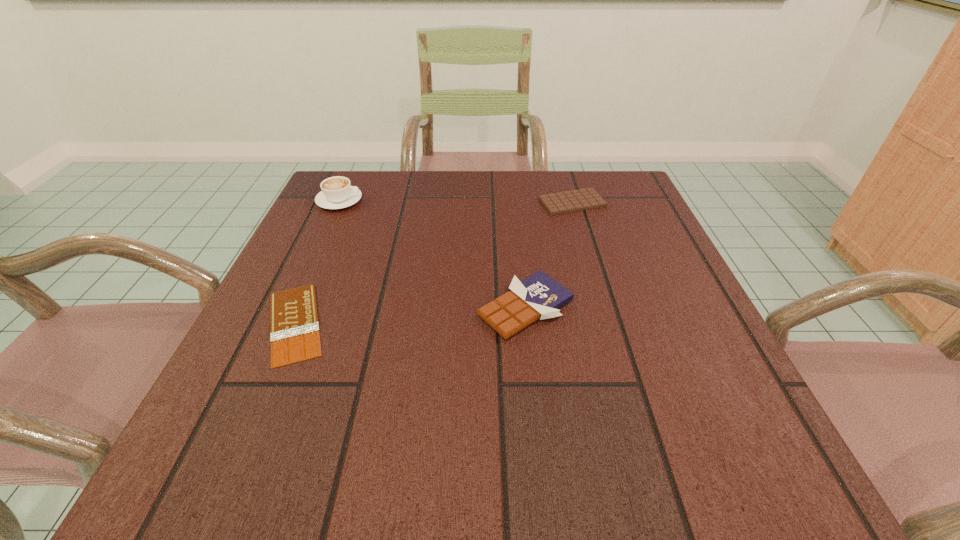
In the image, there is a desktop. Where is `free region at the right edge`? This screenshot has height=540, width=960. free region at the right edge is located at coordinates (717, 361).

Find the location of a particular element. The height and width of the screenshot is (540, 960). vacant space at the far left corner is located at coordinates click(x=341, y=176).

In order to click on vacant space at the near left corner in this screenshot , I will do `click(197, 472)`.

Locate an element on the screen. free space at the far right corner of the desktop is located at coordinates (594, 174).

Where is `free space at the near right corner of the desktop`? The height and width of the screenshot is (540, 960). free space at the near right corner of the desktop is located at coordinates [x=709, y=439].

Where is `free spot between the farthest chocolate bar and the leftmost chocolate bar`? The image size is (960, 540). free spot between the farthest chocolate bar and the leftmost chocolate bar is located at coordinates (434, 263).

The height and width of the screenshot is (540, 960). Find the location of `free space that is in between the farthest chocolate bar and the shortest chocolate bar`. free space that is in between the farthest chocolate bar and the shortest chocolate bar is located at coordinates (434, 263).

Locate an element on the screen. Image resolution: width=960 pixels, height=540 pixels. vacant space that's between the tallest object and the leftmost chocolate bar is located at coordinates (317, 262).

Locate an element on the screen. free space between the tallest object and the farthest chocolate bar is located at coordinates (456, 201).

This screenshot has width=960, height=540. Find the location of `vacant space that is in between the second shortest chocolate bar and the shortest object`. vacant space that is in between the second shortest chocolate bar and the shortest object is located at coordinates (434, 263).